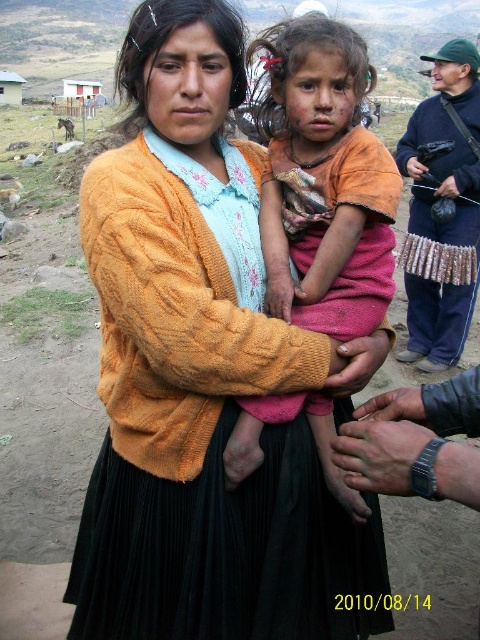
Between orange fabric child at center and metallic silver camera at right, which one appears on the right side from the viewer's perspective?

Positioned to the right is metallic silver camera at right.

Is point (296, 406) behind point (425, 364)?

No, it is in front of (425, 364).

Measure the distance between orange fabric child at center and camera.

A distance of 5.94 feet exists between orange fabric child at center and camera.

Locate an element on the screen. Image resolution: width=480 pixels, height=640 pixels. orange fabric child at center is located at coordinates [324, 182].

In the scene shown: Measure the distance between point (108, 348) and camera.

Point (108, 348) is 6.71 feet away from camera.

Between black knit dress at center and metallic silver camera at right, which one has more height?

Standing taller between the two is metallic silver camera at right.

Who is more forward, (153, 524) or (415, 323)?

Positioned in front is point (153, 524).

Locate an element on the screen. black knit dress at center is located at coordinates (202, 444).

Is black knit dress at center shorter than orange fabric child at center?

Incorrect, black knit dress at center's height does not fall short of orange fabric child at center's.

Does point (129, 264) come behind point (369, 266)?

No, it is not.

Find the location of a particular element. black knit dress at center is located at coordinates (202, 444).